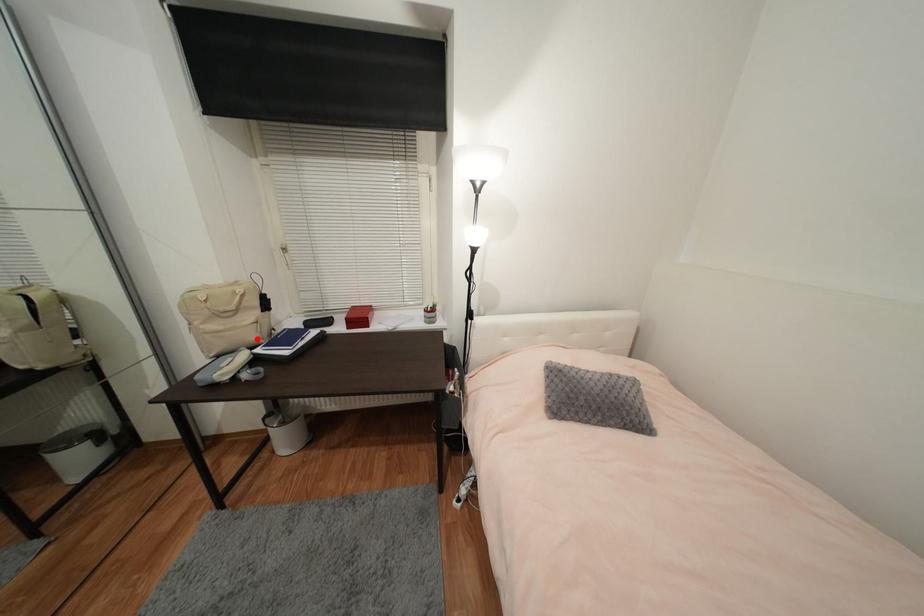
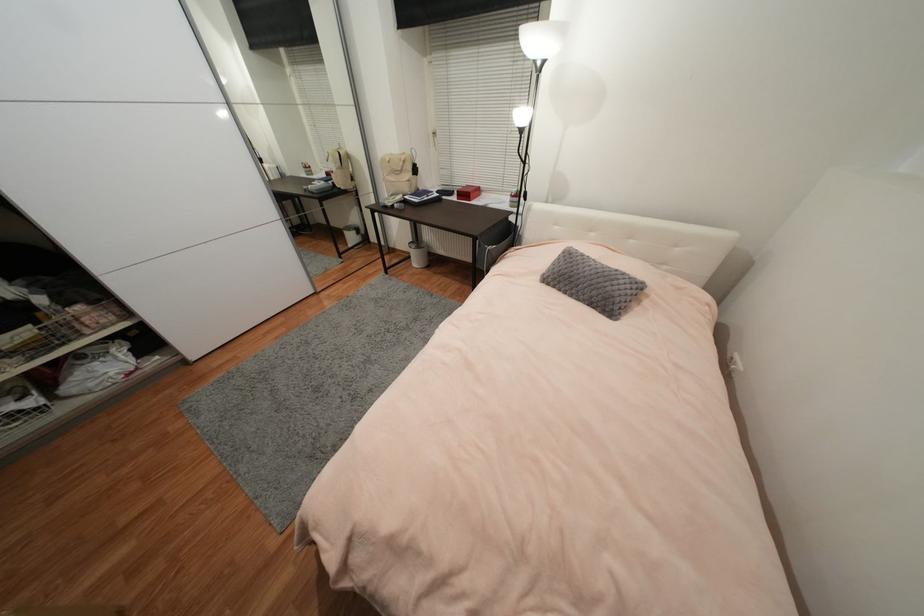
Question: A red point is marked in image1. In image2, is the corresponding 3D point closer to the camera or farther? Reply with the corresponding letter.

Choices:
 (A) The corresponding 3D point is closer.
 (B) The corresponding 3D point is farther.

Answer: (A)